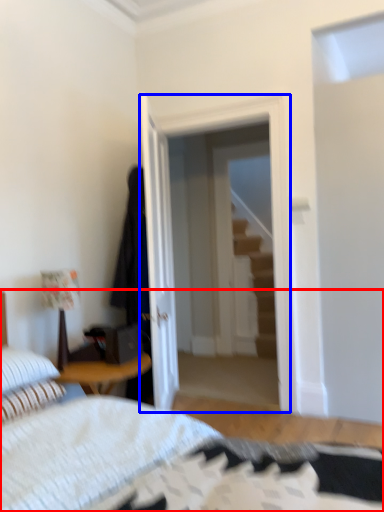
Question: Which point is closer to the camera, bed (highlighted by a red box) or glass door (highlighted by a blue box)?

Choices:
 (A) bed
 (B) glass door

Answer: (A)